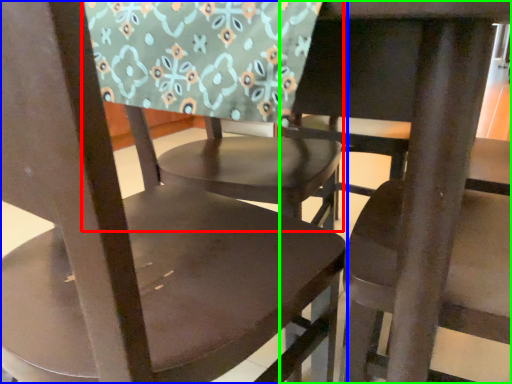
Question: Which object is positioned farthest from chair (highlighted by a red box)? Select from chair (highlighted by a blue box) and chair (highlighted by a green box).

Choices:
 (A) chair
 (B) chair

Answer: (B)